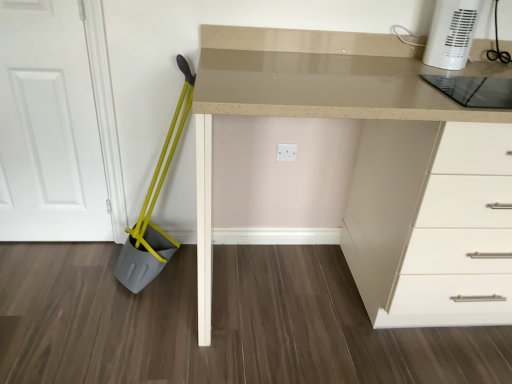
What are the coordinates of `vacant space underneath yellow plastic shovel at left (from a real-world perspective)` in the screenshot? It's located at (174, 272).